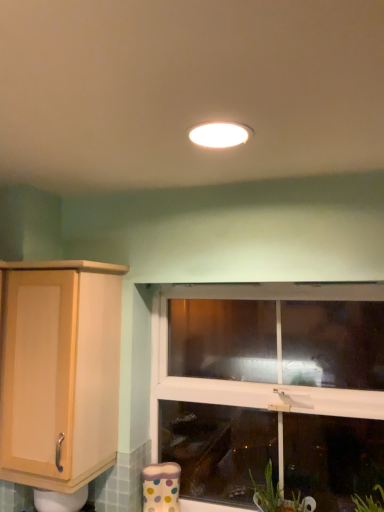
Question: In terms of width, does light wood cabinet at left look wider or thinner when compared to clear glass window at center?

Choices:
 (A) thin
 (B) wide

Answer: (B)

Question: Is light wood cabinet at left in front of or behind clear glass window at center in the image?

Choices:
 (A) behind
 (B) front

Answer: (B)

Question: Which object is the farthest from the white glossy light fixture at center?

Choices:
 (A) clear glass window at center
 (B) light wood cabinet at left

Answer: (A)

Question: Which of these objects is positioned closest to the white glossy light fixture at center?

Choices:
 (A) light wood cabinet at left
 (B) clear glass window at center

Answer: (A)